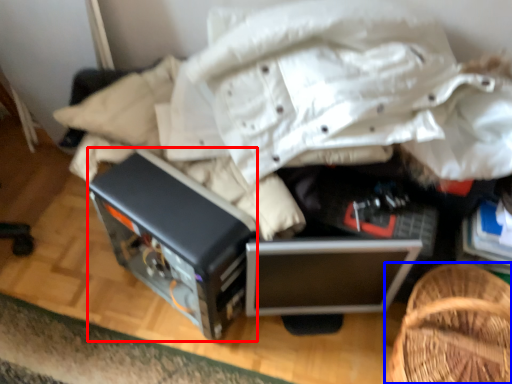
Question: Which object is further to the camera taking this photo, appliance (highlighted by a red box) or furniture (highlighted by a blue box)?

Choices:
 (A) appliance
 (B) furniture

Answer: (A)